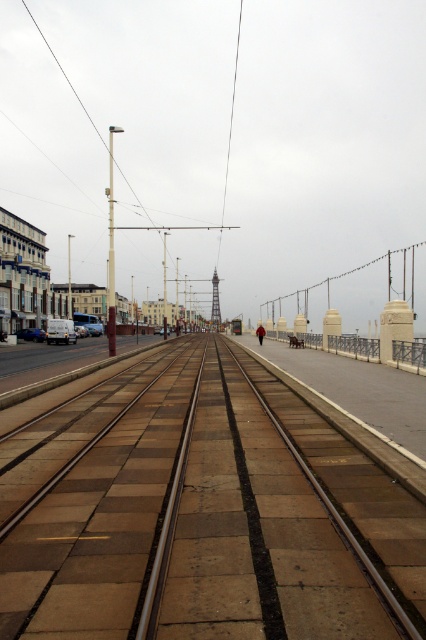
Does point (357, 598) come behind point (213, 278)?

No, it is in front of (213, 278).

Does brown concrete train track at center have a lesser width compared to metallic gray tower at center?

Incorrect, brown concrete train track at center's width is not less than metallic gray tower at center's.

Between point (72, 484) and point (212, 301), which one is positioned behind?

Positioned behind is point (212, 301).

Find the location of a particular element. The height and width of the screenshot is (640, 426). brown concrete train track at center is located at coordinates (203, 515).